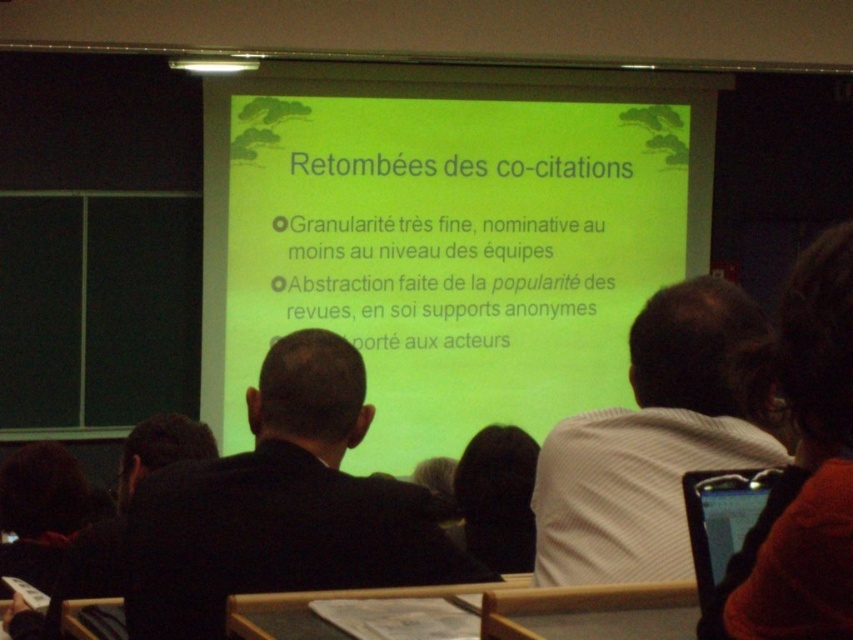
You are sitting in the audience facing the projection screen. There are two points marked on the screen at coordinates point (263, 420) and point (724, 532). Which point appears closer to you?

Point (263, 420) is further to the camera than point (724, 532), so the point that appears closer to you is point (724, 532).

You are sitting in the audience of the presentation and want to take a photo of the green matte projection screen at center and the white striped shirt at right. Which object should you focus on first to ensure both are in focus?

The green matte projection screen at center is further to the viewer than the white striped shirt at right, so you should focus on the green matte projection screen at center first to ensure both are in focus.

You are an attendee at the presentation and want to take a photo of the slide. You have the matte black phone at lower right in your hand. Is the black suit at center blocking your view of the slide?

The black suit at center is below the matte black phone at lower right, so it is positioned lower and would not block the view of the slide when taking a photo with the phone.